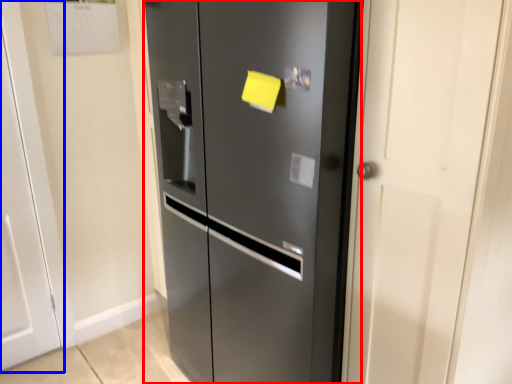
Question: Which point is closer to the camera, door (highlighted by a red box) or door (highlighted by a blue box)?

Choices:
 (A) door
 (B) door

Answer: (A)